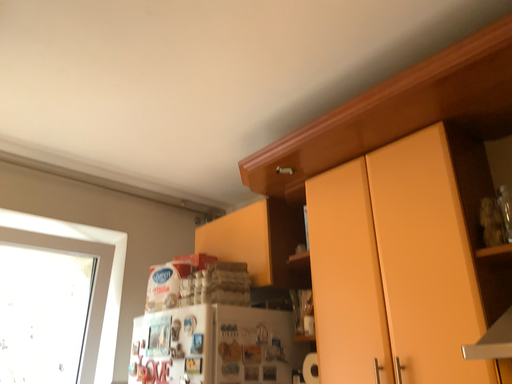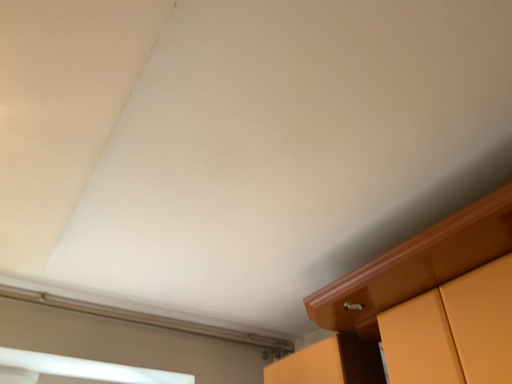
Question: Which way did the camera rotate in the video?

Choices:
 (A) rotated left
 (B) rotated right

Answer: (A)